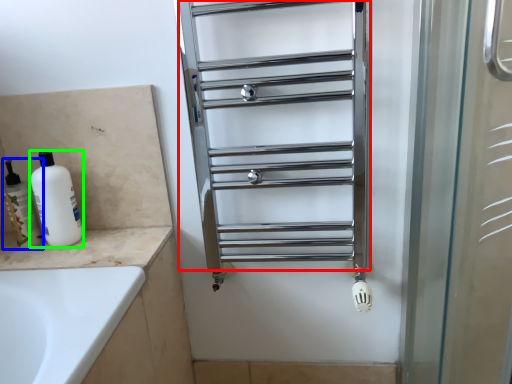
Question: Based on their relative distances, which object is nearer to cage (highlighted by a red box)? Choose from toiletry (highlighted by a blue box) and cleaning product (highlighted by a green box).

Choices:
 (A) toiletry
 (B) cleaning product

Answer: (B)